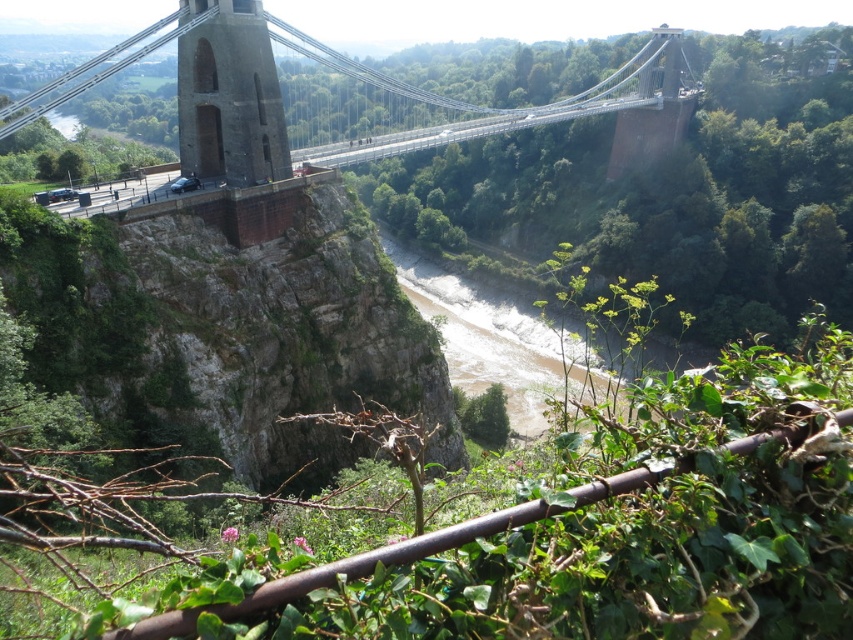
Question: Which object appears closest to the camera in this image?

Choices:
 (A) concrete bridge at center
 (B) brown sandy river at center
 (C) dark gray stone tower at center

Answer: (A)

Question: Which point is farther to the camera?

Choices:
 (A) (689, 346)
 (B) (236, 24)

Answer: (A)

Question: Does brown sandy river at center lie in front of dark gray stone tower at center?

Choices:
 (A) yes
 (B) no

Answer: (B)

Question: Observing the image, what is the correct spatial positioning of concrete bridge at center in reference to brown sandy river at center?

Choices:
 (A) left
 (B) right

Answer: (A)

Question: Does concrete bridge at center have a greater width compared to dark gray stone tower at center?

Choices:
 (A) no
 (B) yes

Answer: (B)

Question: Which object is closer to the camera taking this photo?

Choices:
 (A) concrete bridge at center
 (B) brown sandy river at center

Answer: (A)